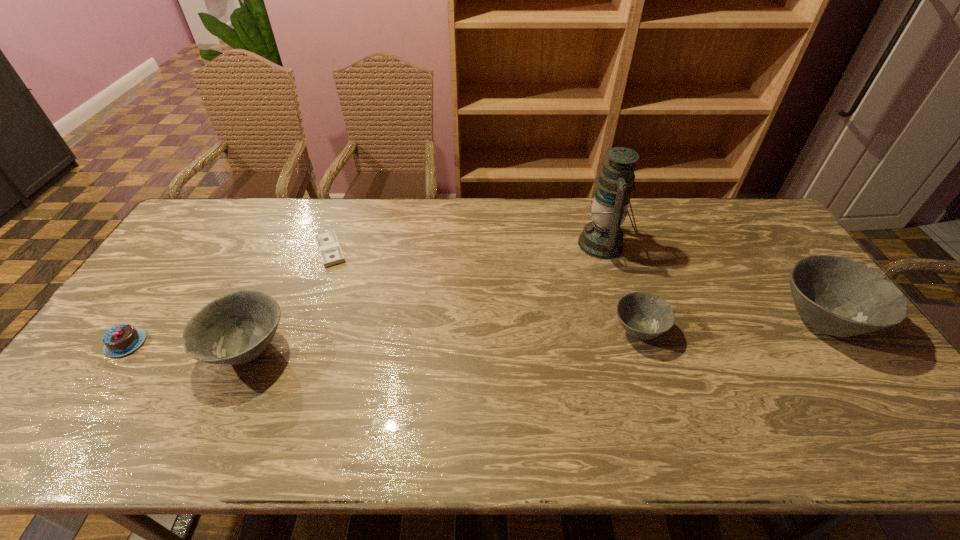
Locate an element on the screen. vacant space at the far edge is located at coordinates (444, 222).

In the image, there is a desktop. Where is `free space at the near edge`? free space at the near edge is located at coordinates (548, 397).

At what (x,y) coordinates should I click in order to perform the action: click on vacant space at the left edge of the desktop. Please return your answer as a coordinate pair (x, y). This screenshot has width=960, height=540. Looking at the image, I should click on (192, 265).

In the image, there is a desktop. Where is `free region at the far right corner`? The image size is (960, 540). free region at the far right corner is located at coordinates (765, 225).

You are a GUI agent. You are given a task and a screenshot of the screen. Output one action in this format:
    pyautogui.click(x=<x>, y=<y>)
    Task: Click on the free space between the shortest bowl and the leftmost object
    This screenshot has height=540, width=960.
    Given the screenshot: What is the action you would take?
    pyautogui.click(x=382, y=336)

At what (x,y) coordinates should I click in order to perform the action: click on unoccupied area between the oil lamp and the rightmost object. Please return your answer as a coordinate pair (x, y). The width and height of the screenshot is (960, 540). Looking at the image, I should click on point(712,282).

Image resolution: width=960 pixels, height=540 pixels. Identify the location of free spot between the shortest object and the second bowl from right to left. coord(484,290).

Find the location of `free space between the chocolate cake and the second bowl from left to right`. free space between the chocolate cake and the second bowl from left to right is located at coordinates (382, 336).

I want to click on vacant region between the second shortest bowl and the shortest object, so click(289, 300).

Where is `empty space between the third shortest object and the second tallest bowl`? The image size is (960, 540). empty space between the third shortest object and the second tallest bowl is located at coordinates (444, 340).